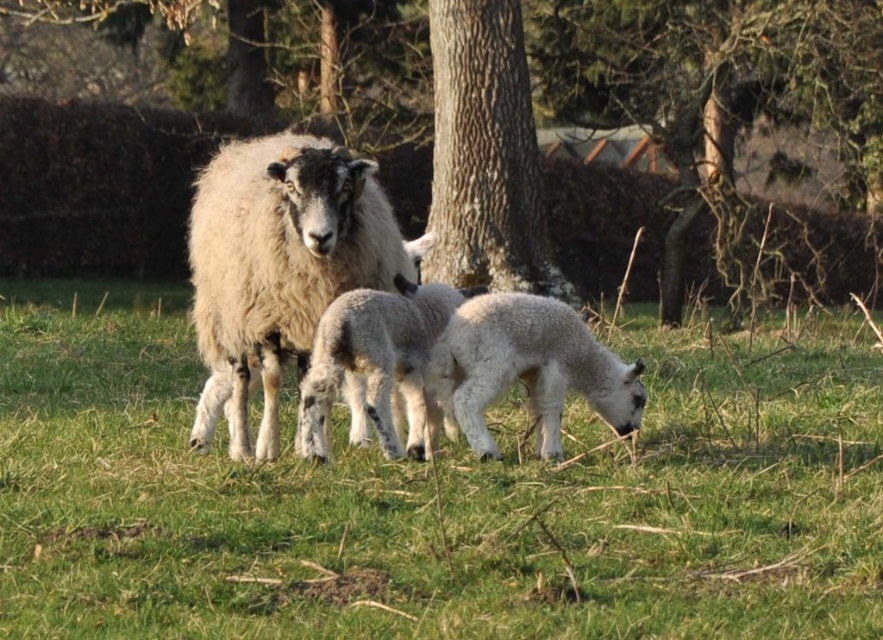
You are a farmer checking the distance between two trees in your field. You have a 2.0 meters long fence panel. Can you place it exactly between the smooth bark tree at center and the rough bark tree at center to connect them?

The smooth bark tree at center is 2.07 meters away from the rough bark tree at center. Since the fence panel is 2.0 meters long, it is slightly shorter than the distance between the trees. Therefore, the fence panel cannot span the entire gap between them.

Based on the scene description, which object takes up more area in the image between the fuzzy white sheep at center and the rough bark tree at center?

The rough bark tree at center takes up more area in the image than the fuzzy white sheep at center because the fuzzy white sheep at center occupies less space than rough bark tree at center.

From the picture: You are standing in the field where the sheep and lambs are grazing. There is a smooth bark tree at center located at point (x=571, y=120). If you walk straight towards the tree, will you pass by any of the grazing sheep or lambs?

The smooth bark tree at center is located at point (x=571, y=120). Since the sheep and lambs are positioned to the left and close to the sheep, walking straight towards the tree might require passing near them, but the exact path depends on their exact positions relative to the tree. However, based on the given information, the tree is at the center, so you might pass by the sheep and lambs on the left side before reaching the tree.